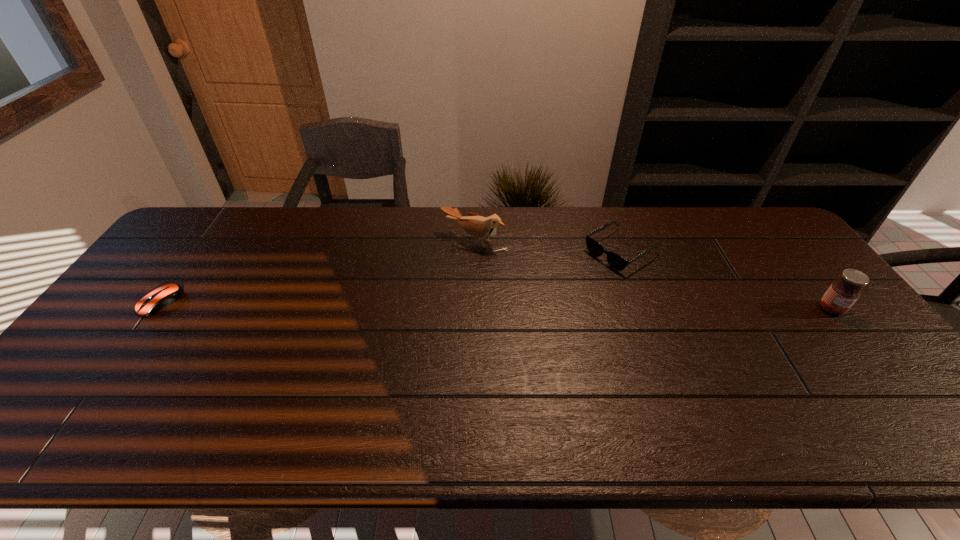
The height and width of the screenshot is (540, 960). I want to click on free space on the desktop that is between the computer mouse and the rightmost object and is positioned at the beak of the bird, so click(x=417, y=305).

You are a GUI agent. You are given a task and a screenshot of the screen. Output one action in this format:
    pyautogui.click(x=<x>, y=<y>)
    Task: Click on the free space on the desktop that is between the computer mouse and the jam and is positioned at the front lenses of the second shortest object
    
    Given the screenshot: What is the action you would take?
    pyautogui.click(x=529, y=306)